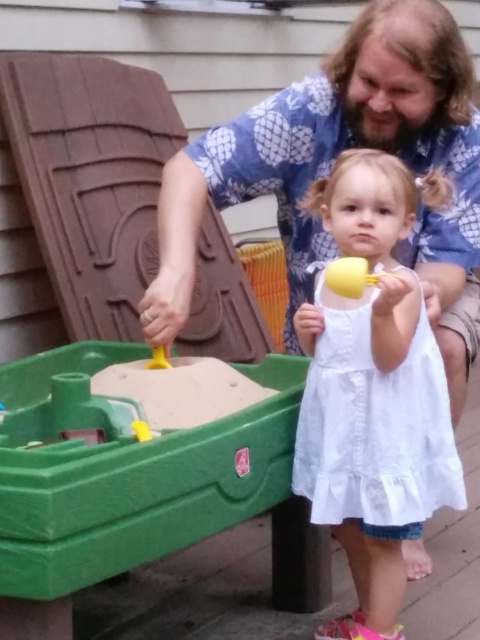
You are standing at the point marked as point (374,428). What object are you standing on?

The point (374,428) is on the white lace dress at center.

Based on the scene description, where is the white lace dress at center in relation to the yellow plastic shovel at lower center?

The white lace dress at center is located below the yellow plastic shovel at lower center according to the description.